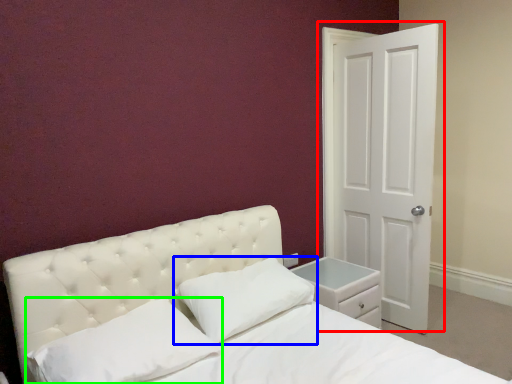
Question: Which object is the farthest from door (highlighted by a red box)? Choose among these: pillow (highlighted by a blue box) or pillow (highlighted by a green box).

Choices:
 (A) pillow
 (B) pillow

Answer: (B)